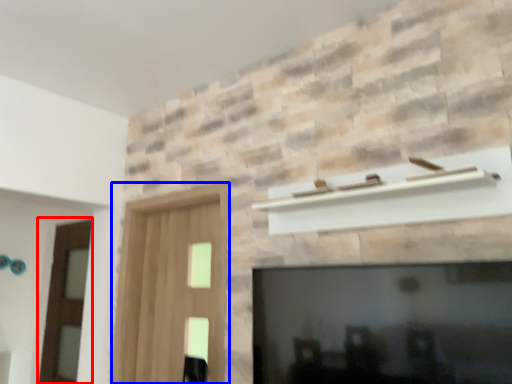
Question: Among these objects, which one is farthest to the camera, screen door (highlighted by a red box) or screen door (highlighted by a blue box)?

Choices:
 (A) screen door
 (B) screen door

Answer: (A)